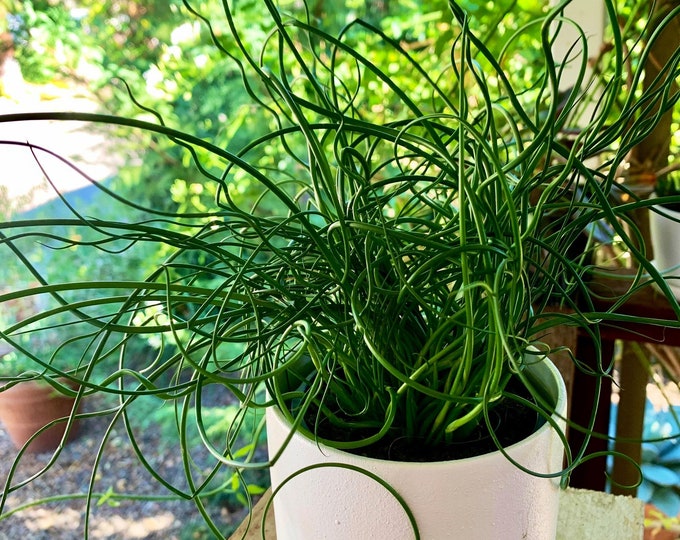
The height and width of the screenshot is (540, 680). In order to click on wood table surface in this screenshot , I will do `click(258, 530)`.